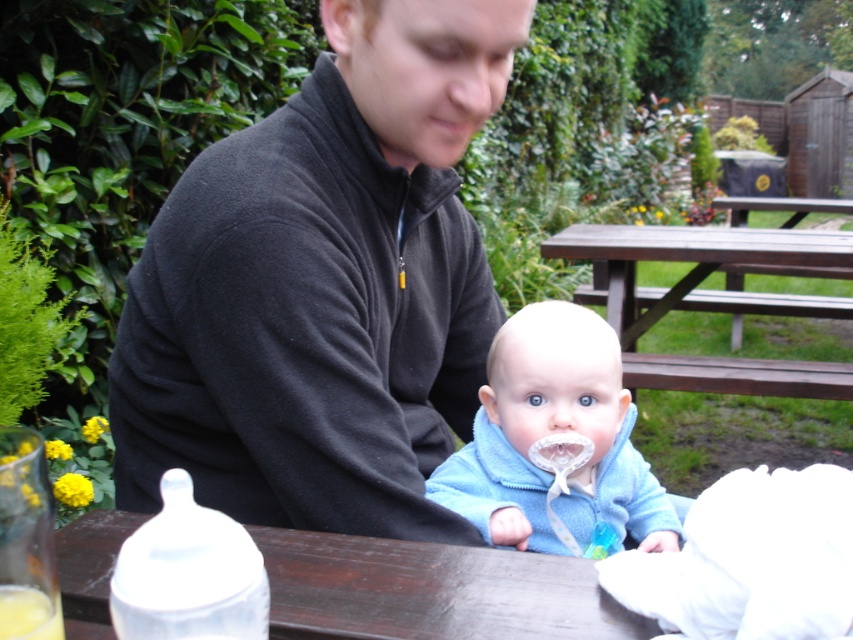
You are organizing a small outdoor event and need to place a 20 cm wide decorative item on the picnic table. The table has limited space between the black fleece jacket at upper center and the transparent plastic bottle at lower left. Can you fit the item there?

→ The black fleece jacket at upper center might be wider than the transparent plastic bottle at lower left, so the space between them may not be sufficient to fit a 20 cm wide decorative item. Check the actual distance before placing it.

You are a photographer setting up for a family photo. You notice the blue fleece jacket at center and the brown wooden picnic table at center in the scene. Which object should you adjust your camera angle to focus on if you want to capture the taller object?

The brown wooden picnic table at center is taller than the blue fleece jacket at center, so you should adjust your camera angle to focus on the brown wooden picnic table at center to capture the taller object.

You are planning to place a new object between the blue fleece jacket at center and the brown wooden picnic table at center. Which object should be placed closer to the smaller one?

The blue fleece jacket at center is smaller than the brown wooden picnic table at center, so the new object should be placed closer to the blue fleece jacket at center.